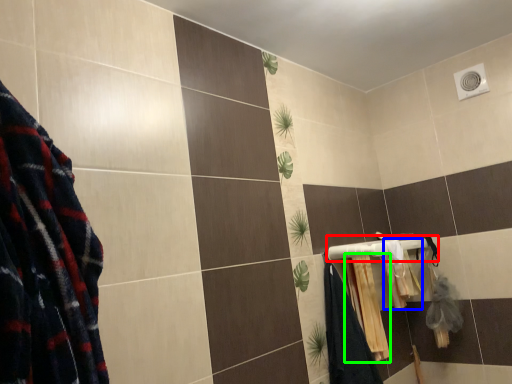
Question: Which is nearer to the towel bar (highlighted by a red box)? bath towel (highlighted by a blue box) or bath towel (highlighted by a green box).

Choices:
 (A) bath towel
 (B) bath towel

Answer: (A)